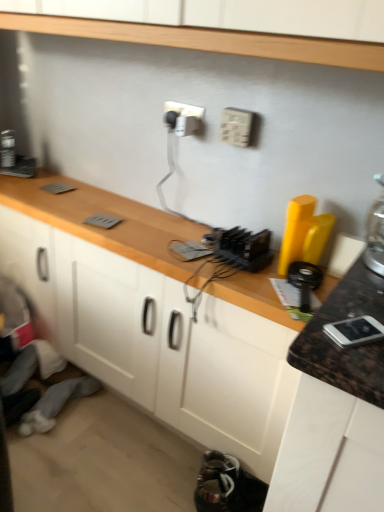
Question: From the image's perspective, is white plastic electric outlet at upper center, acting as the 1th electric outlet starting from the right, above multicolored fabric shoes at lower center?

Choices:
 (A) no
 (B) yes

Answer: (B)

Question: Is there a large distance between white plastic electric outlet at upper center, which appears as the 2th electric outlet when viewed from the back, and multicolored fabric shoes at lower center?

Choices:
 (A) yes
 (B) no

Answer: (A)

Question: Is multicolored fabric shoes at lower center inside white plastic electric outlet at upper center, which appears as the 2th electric outlet when viewed from the back?

Choices:
 (A) no
 (B) yes

Answer: (A)

Question: Is white plastic electric outlet at upper center, the second electric outlet from the left, oriented away from multicolored fabric shoes at lower center?

Choices:
 (A) yes
 (B) no

Answer: (B)

Question: Is white plastic electric outlet at upper center, the second electric outlet from the left, taller than multicolored fabric shoes at lower center?

Choices:
 (A) no
 (B) yes

Answer: (A)

Question: Looking at the image, does matte gray cabinet at lower left seem bigger or smaller compared to silver metallic phone at right?

Choices:
 (A) big
 (B) small

Answer: (A)

Question: In the image, is matte gray cabinet at lower left on the left side or the right side of silver metallic phone at right?

Choices:
 (A) left
 (B) right

Answer: (A)

Question: Is matte gray cabinet at lower left taller or shorter than silver metallic phone at right?

Choices:
 (A) tall
 (B) short

Answer: (A)

Question: Does point (46, 266) appear closer or farther from the camera than point (329, 327)?

Choices:
 (A) farther
 (B) closer

Answer: (A)

Question: In the image, is white plastic electric outlet at upper center, acting as the 1th electric outlet starting from the right, on the left side or the right side of white plastic electric outlet at upper center, the 1th electric outlet viewed from the back?

Choices:
 (A) left
 (B) right

Answer: (B)

Question: From the image's perspective, is white plastic electric outlet at upper center, which appears as the 2th electric outlet when viewed from the back, positioned above or below white plastic electric outlet at upper center, which ranks as the second electric outlet in right-to-left order?

Choices:
 (A) below
 (B) above

Answer: (A)

Question: From a real-world perspective, relative to white plastic electric outlet at upper center, the second electric outlet from the front, is white plastic electric outlet at upper center, acting as the 1th electric outlet starting from the right, vertically above or below?

Choices:
 (A) below
 (B) above

Answer: (B)

Question: Is white plastic electric outlet at upper center, the second electric outlet from the left, in front of or behind white plastic electric outlet at upper center, the 1th electric outlet when ordered from left to right, in the image?

Choices:
 (A) front
 (B) behind

Answer: (A)

Question: From the image's perspective, is white plastic electric outlet at upper center, which appears as the 2th electric outlet when viewed from the back, above or below matte gray cabinet at lower left?

Choices:
 (A) above
 (B) below

Answer: (A)

Question: Is point (228, 126) positioned closer to the camera than point (43, 234)?

Choices:
 (A) closer
 (B) farther

Answer: (A)